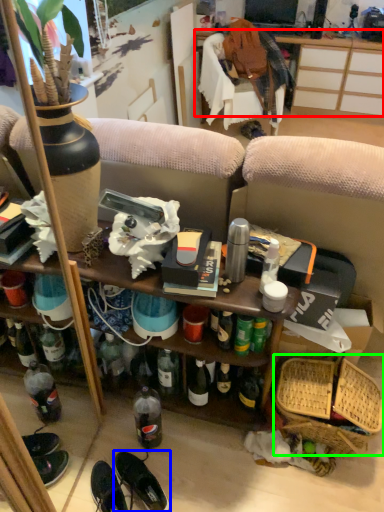
Question: Considering the real-world distances, which object is closest to desk (highlighted by a red box)? footwear (highlighted by a blue box) or basket (highlighted by a green box).

Choices:
 (A) footwear
 (B) basket

Answer: (B)